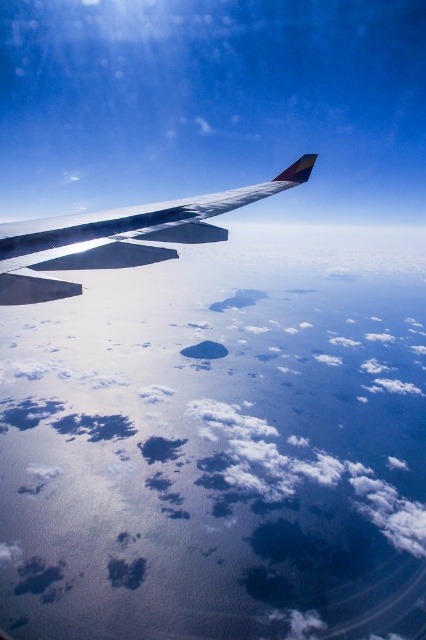
You are a pilot checking the flight path. You notice the white fluffy cloud at upper center and the metallic silver wing at upper left. Which object is wider from your current viewpoint?

The white fluffy cloud at upper center might be wider than the metallic silver wing at upper left according to the description.

You are a pilot flying at an altitude of 2000 feet. You notice the white fluffy cloud at upper center and the metallic silver wing at upper left from your window. Can you safely descend to 1500 feet without colliding with the cloud?

The white fluffy cloud at upper center is 1816.97 feet away from the metallic silver wing at upper left. Since the plane is flying at 2000 feet and the cloud is 1816.97 feet away, descending to 1500 feet would bring the plane closer to the cloud than the required safety distance. Therefore, it is not safe to descend.